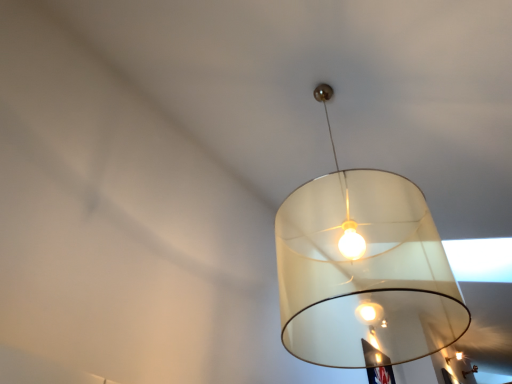
What do you see at coordinates (470, 371) in the screenshot?
I see `matte white lampshade at center, which is the 3th lamp from left to right` at bounding box center [470, 371].

The width and height of the screenshot is (512, 384). Describe the element at coordinates (362, 271) in the screenshot. I see `translucent white lampshade at upper center, which ranks as the third lamp in back-to-front order` at that location.

Where is `matte white lampshade at center, which is the 3th lamp from left to right`? matte white lampshade at center, which is the 3th lamp from left to right is located at coordinates (470, 371).

Is matte white lampshade at center, which appears as the third lamp when viewed from the front, taller or shorter than translucent white lampshade at upper center, which appears as the 1th lamp when viewed from the front?

Considering their sizes, matte white lampshade at center, which appears as the third lamp when viewed from the front, has less height than translucent white lampshade at upper center, which appears as the 1th lamp when viewed from the front.

Find the location of `the 2nd lamp directly above the translucent white lampshade at upper center, which ranks as the third lamp in back-to-front order (from a real-world perspective)`. the 2nd lamp directly above the translucent white lampshade at upper center, which ranks as the third lamp in back-to-front order (from a real-world perspective) is located at coordinates (470, 371).

Would you say matte white lampshade at center, the first lamp positioned from the bottom, is a long distance from translucent white lampshade at upper center, which ranks as the third lamp in back-to-front order?

Actually, matte white lampshade at center, the first lamp positioned from the bottom, and translucent white lampshade at upper center, which ranks as the third lamp in back-to-front order, are a little close together.

Is matte white lampshade at center, the first lamp positioned from the bottom, facing away from translucent white lampshade at upper center, which ranks as the third lamp in right-to-left order?

No, matte white lampshade at center, the first lamp positioned from the bottom, is not facing away from translucent white lampshade at upper center, which ranks as the third lamp in right-to-left order.

Between translucent white lampshade at upper center, which ranks as the third lamp in back-to-front order, and matte white lampshade at center, which appears as the third lamp when viewed from the front, which one appears on the right side from the viewer's perspective?

matte white lampshade at center, which appears as the third lamp when viewed from the front, is more to the right.

Looking at this image, from the image's perspective, is translucent white lampshade at upper center, which ranks as the third lamp in right-to-left order, under matte white lampshade at center, positioned as the first lamp in back-to-front order?

No, from the image's perspective, translucent white lampshade at upper center, which ranks as the third lamp in right-to-left order, is not beneath matte white lampshade at center, positioned as the first lamp in back-to-front order.

Is translucent white lampshade at upper center, which ranks as the third lamp in back-to-front order, aimed at matte white lampshade at center, the 3th lamp positioned from the top?

Yes, translucent white lampshade at upper center, which ranks as the third lamp in back-to-front order, is facing matte white lampshade at center, the 3th lamp positioned from the top.

Would you say translucent white lampshade at upper center, marked as the 1th lamp in a left-to-right arrangement, is a long distance from matte white lampshade at center, which appears as the third lamp when viewed from the front?

translucent white lampshade at upper center, marked as the 1th lamp in a left-to-right arrangement, is near matte white lampshade at center, which appears as the third lamp when viewed from the front, not far away.

From the image's perspective, who appears lower, matte white lampshade at center, the second lamp ordered from the bottom, or translucent white lampshade at upper center, positioned as the first lamp in top-to-bottom order?

matte white lampshade at center, the second lamp ordered from the bottom, is shown below in the image.

Is matte white lampshade at center, marked as the 2th lamp in a front-to-back arrangement, spatially inside translucent white lampshade at upper center, which ranks as the third lamp in back-to-front order, or outside of it?

matte white lampshade at center, marked as the 2th lamp in a front-to-back arrangement, is outside translucent white lampshade at upper center, which ranks as the third lamp in back-to-front order.

Does matte white lampshade at center, placed as the second lamp when sorted from back to front, have a lesser height compared to translucent white lampshade at upper center, arranged as the 3th lamp when ordered from the bottom?

Yes.

Is matte white lampshade at center, the second lamp when ordered from right to left, aimed at translucent white lampshade at upper center, marked as the 1th lamp in a left-to-right arrangement?

No.

In the scene shown: From a real-world perspective, between translucent white lampshade at upper center, positioned as the first lamp in top-to-bottom order, and matte white lampshade at center, placed as the second lamp when sorted from back to front, who is vertically higher?

matte white lampshade at center, placed as the second lamp when sorted from back to front, is physically above.

Considering the sizes of objects translucent white lampshade at upper center, arranged as the 3th lamp when ordered from the bottom, and matte white lampshade at center, the second lamp ordered from the bottom, in the image provided, who is shorter, translucent white lampshade at upper center, arranged as the 3th lamp when ordered from the bottom, or matte white lampshade at center, the second lamp ordered from the bottom,?

Standing shorter between the two is matte white lampshade at center, the second lamp ordered from the bottom.

Considering the positions of objects translucent white lampshade at upper center, which ranks as the third lamp in back-to-front order, and matte white lampshade at center, which is the second lamp in left-to-right order, in the image provided, who is behind, translucent white lampshade at upper center, which ranks as the third lamp in back-to-front order, or matte white lampshade at center, which is the second lamp in left-to-right order,?

matte white lampshade at center, which is the second lamp in left-to-right order, is more distant.

Could matte white lampshade at center, the second lamp when ordered from right to left, be considered to be inside translucent white lampshade at upper center, which ranks as the third lamp in back-to-front order?

Definitely not — matte white lampshade at center, the second lamp when ordered from right to left, is not inside translucent white lampshade at upper center, which ranks as the third lamp in back-to-front order.

From the picture: From a real-world perspective, is matte white lampshade at center, marked as the 2th lamp in a front-to-back arrangement, located higher than matte white lampshade at center, positioned as the first lamp in back-to-front order?

No, from a real-world perspective, matte white lampshade at center, marked as the 2th lamp in a front-to-back arrangement, is not over matte white lampshade at center, positioned as the first lamp in back-to-front order

Is matte white lampshade at center, the second lamp when ordered from right to left, smaller than matte white lampshade at center, the first lamp positioned from the bottom?

No, matte white lampshade at center, the second lamp when ordered from right to left, is not smaller than matte white lampshade at center, the first lamp positioned from the bottom.

In the scene shown: Which is more to the left, matte white lampshade at center, placed as the second lamp when sorted from back to front, or matte white lampshade at center, which appears as the third lamp when viewed from the front?

From the viewer's perspective, matte white lampshade at center, placed as the second lamp when sorted from back to front, appears more on the left side.

You are a GUI agent. You are given a task and a screenshot of the screen. Output one action in this format:
    pyautogui.click(x=<x>, y=<y>)
    Task: Click on the lamp that appears above the matte white lampshade at center, the second lamp ordered from the bottom (from a real-world perspective)
    
    Given the screenshot: What is the action you would take?
    pyautogui.click(x=470, y=371)

Considering the relative sizes of matte white lampshade at center, the 3th lamp positioned from the top, and matte white lampshade at center, the second lamp when ordered from right to left, in the image provided, is matte white lampshade at center, the 3th lamp positioned from the top, taller than matte white lampshade at center, the second lamp when ordered from right to left,?

No.

Is matte white lampshade at center, the 3th lamp positioned from the top, outside of matte white lampshade at center, acting as the 2th lamp starting from the top?

Indeed, matte white lampshade at center, the 3th lamp positioned from the top, is completely outside matte white lampshade at center, acting as the 2th lamp starting from the top.

From the image's perspective, which lamp is the 2nd one above the matte white lampshade at center, which appears as the first lamp when viewed from the right? Please provide its 2D coordinates.

[(362, 271)]

From a real-world perspective, starting from the matte white lampshade at center, which is the 3th lamp from left to right, which lamp is the 2nd one below it? Please provide its 2D coordinates.

[(362, 271)]

When comparing their distances from matte white lampshade at center, marked as the 2th lamp in a front-to-back arrangement, does translucent white lampshade at upper center, which ranks as the third lamp in right-to-left order, or matte white lampshade at center, the first lamp positioned from the bottom, seem further?

Among the two, translucent white lampshade at upper center, which ranks as the third lamp in right-to-left order, is located further to matte white lampshade at center, marked as the 2th lamp in a front-to-back arrangement.

Based on their spatial positions, is matte white lampshade at center, the 3th lamp positioned from the top, or translucent white lampshade at upper center, marked as the 1th lamp in a left-to-right arrangement, further from matte white lampshade at center, placed as the second lamp when sorted from back to front?

Based on the image, translucent white lampshade at upper center, marked as the 1th lamp in a left-to-right arrangement, appears to be further to matte white lampshade at center, placed as the second lamp when sorted from back to front.

Which object lies nearer to the anchor point translucent white lampshade at upper center, positioned as the first lamp in top-to-bottom order, matte white lampshade at center, which is the 3th lamp from left to right, or matte white lampshade at center, marked as the 2th lamp in a front-to-back arrangement?

matte white lampshade at center, marked as the 2th lamp in a front-to-back arrangement.

From the image, which object appears to be farther from translucent white lampshade at upper center, marked as the 1th lamp in a left-to-right arrangement, matte white lampshade at center, the second lamp when ordered from right to left, or matte white lampshade at center, the first lamp positioned from the bottom?

matte white lampshade at center, the first lamp positioned from the bottom.

When comparing their distances from matte white lampshade at center, positioned as the first lamp in back-to-front order, does translucent white lampshade at upper center, which ranks as the third lamp in right-to-left order, or matte white lampshade at center, acting as the 2th lamp starting from the top, seem closer?

matte white lampshade at center, acting as the 2th lamp starting from the top.

Considering their positions, is matte white lampshade at center, the second lamp ordered from the bottom, positioned closer to matte white lampshade at center, which appears as the first lamp when viewed from the right, than translucent white lampshade at upper center, which ranks as the third lamp in back-to-front order?

matte white lampshade at center, the second lamp ordered from the bottom, is closer to matte white lampshade at center, which appears as the first lamp when viewed from the right.

This screenshot has width=512, height=384. In order to click on lamp between translucent white lampshade at upper center, arranged as the 3th lamp when ordered from the bottom, and matte white lampshade at center, the first lamp positioned from the bottom, from front to back in this screenshot , I will do `click(455, 357)`.